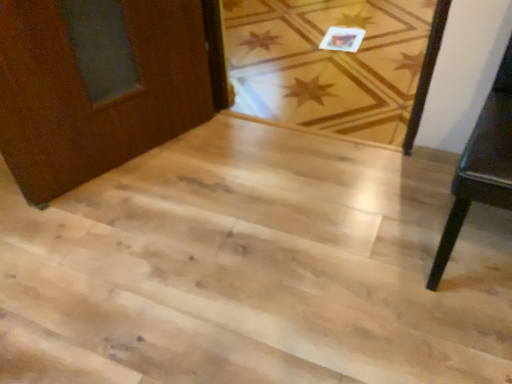
You are a GUI agent. You are given a task and a screenshot of the screen. Output one action in this format:
    pyautogui.click(x=<x>, y=<y>)
    Task: Click on the free space above light wood stairs at center (from a real-world perspective)
    Image resolution: width=512 pixels, height=384 pixels.
    Given the screenshot: What is the action you would take?
    pyautogui.click(x=229, y=234)